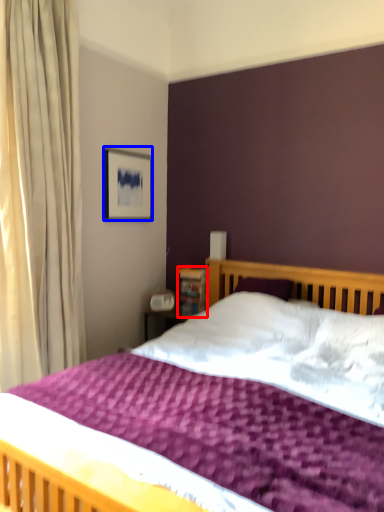
Question: Among these objects, which one is farthest to the camera, bookshelf (highlighted by a red box) or picture frame (highlighted by a blue box)?

Choices:
 (A) bookshelf
 (B) picture frame

Answer: (A)